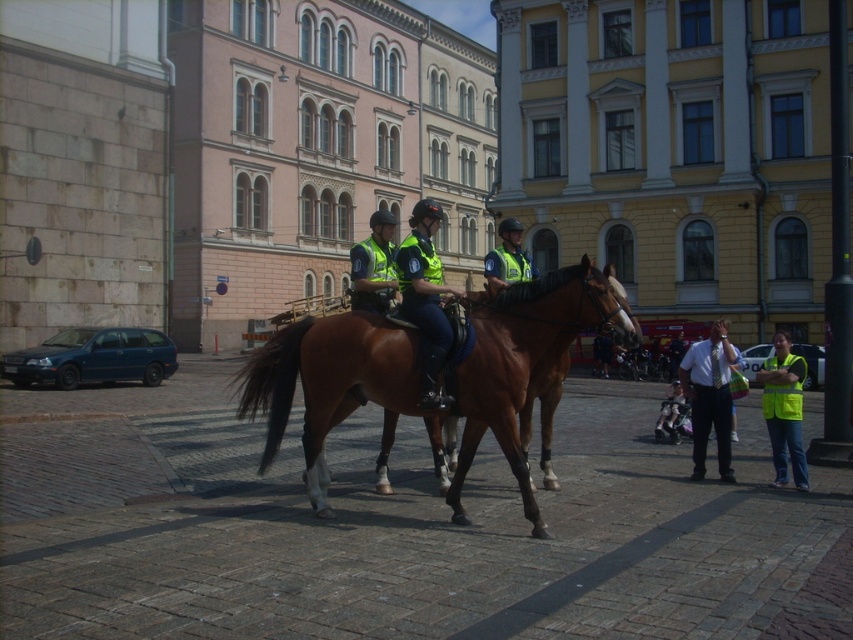
Question: Is high visibility yellow vest at lower right bigger than reflective green uniform at center?

Choices:
 (A) yes
 (B) no

Answer: (B)

Question: Estimate the real-world distances between objects in this image. Which object is farther from the reflective green uniform at center?

Choices:
 (A) brown glossy horse at center
 (B) reflective blue uniform at center
 (C) reflective yellow vest at center

Answer: (A)

Question: Among these objects, which one is nearest to the camera?

Choices:
 (A) high visibility yellow vest at lower right
 (B) reflective blue uniform at center

Answer: (B)

Question: Which of these objects is positioned closest to the reflective yellow vest at center?

Choices:
 (A) reflective blue uniform at center
 (B) light blue shirt with tie at center
 (C) neon yellow vest at lower right

Answer: (B)

Question: Can you confirm if neon yellow vest at lower right is thinner than reflective yellow vest at center?

Choices:
 (A) yes
 (B) no

Answer: (B)

Question: Can you confirm if light blue shirt with tie at center is smaller than reflective yellow vest at center?

Choices:
 (A) yes
 (B) no

Answer: (A)